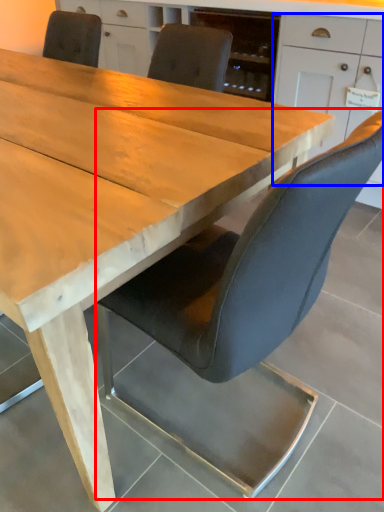
Question: Which point is further to the camera, chair (highlighted by a red box) or cabinetry (highlighted by a blue box)?

Choices:
 (A) chair
 (B) cabinetry

Answer: (B)